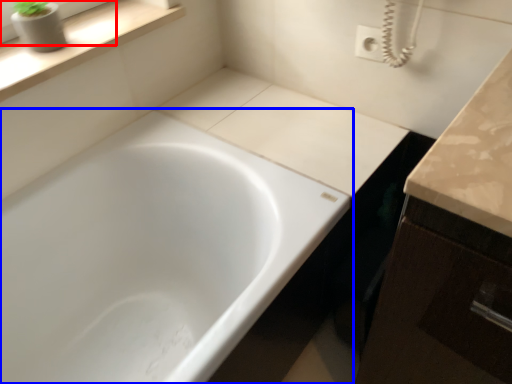
Question: Among these objects, which one is farthest to the camera, window frame (highlighted by a red box) or bathtub (highlighted by a blue box)?

Choices:
 (A) window frame
 (B) bathtub

Answer: (A)